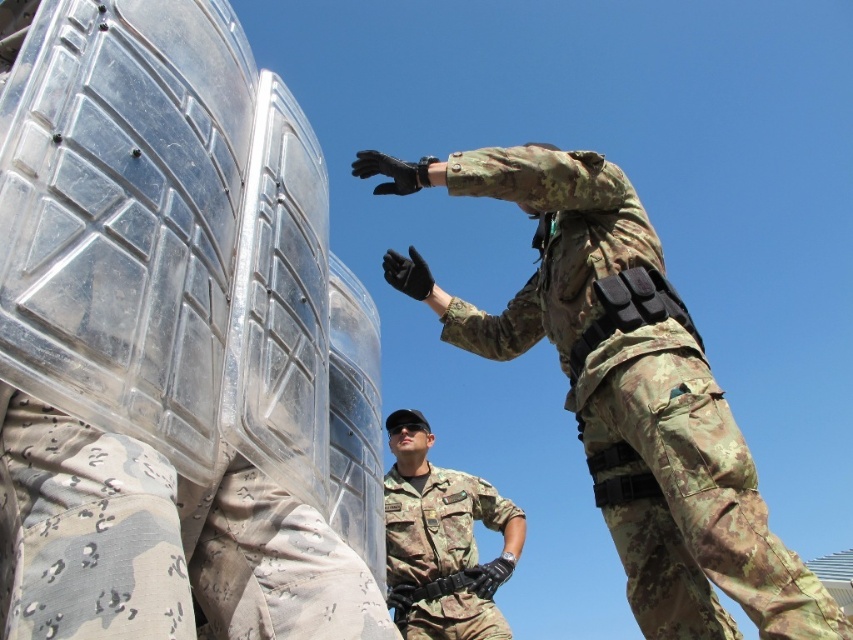
Question: Which of the following is the closest to the observer?

Choices:
 (A) camouflage fabric uniform at center
 (B) camouflage uniform at center

Answer: (A)

Question: Which of the following is the closest to the observer?

Choices:
 (A) (503, 358)
 (B) (424, 509)

Answer: (A)

Question: Does camouflage fabric uniform at center appear over camouflage uniform at center?

Choices:
 (A) no
 (B) yes

Answer: (B)

Question: Does camouflage fabric uniform at center have a lesser width compared to camouflage uniform at center?

Choices:
 (A) no
 (B) yes

Answer: (A)

Question: Which point is closer to the camera?

Choices:
 (A) camouflage fabric uniform at center
 (B) camouflage uniform at center

Answer: (A)

Question: Does camouflage fabric uniform at center have a smaller size compared to camouflage uniform at center?

Choices:
 (A) no
 (B) yes

Answer: (A)